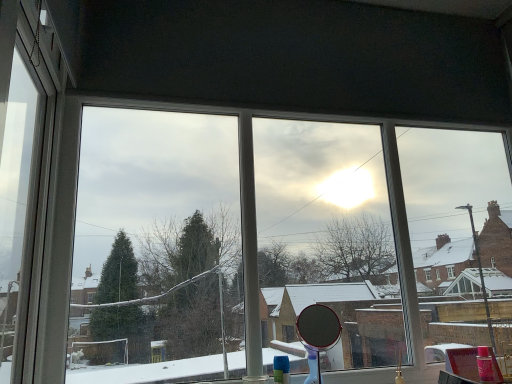
Where is `white plastic window frame at left`? Image resolution: width=512 pixels, height=384 pixels. white plastic window frame at left is located at coordinates (20, 161).

Measure the distance between point (385, 245) and camera.

The distance of point (385, 245) from camera is 11.19 feet.

The height and width of the screenshot is (384, 512). What do you see at coordinates (318, 331) in the screenshot? I see `polished silver mirror at center` at bounding box center [318, 331].

You are a GUI agent. You are given a task and a screenshot of the screen. Output one action in this format:
    pyautogui.click(x=<x>, y=<y>)
    Task: Click on the white plastic window frame at left
    The image size is (512, 384).
    Given the screenshot: What is the action you would take?
    pyautogui.click(x=20, y=161)

Which is in front, white plastic window frame at left or polished silver mirror at center?

white plastic window frame at left is in front.

From the picture: Looking at their sizes, would you say white plastic window frame at left is wider or thinner than polished silver mirror at center?

white plastic window frame at left is thinner than polished silver mirror at center.

Is polished silver mirror at center surrounded by white plastic window frame at left?

No, polished silver mirror at center is not surrounded by white plastic window frame at left.

Is white plastic window frame at left facing away from polished silver mirror at center?

No.

In terms of size, does transparent glass mirror at center appear bigger or smaller than polished silver mirror at center?

Considering their sizes, transparent glass mirror at center takes up more space than polished silver mirror at center.

Between transparent glass mirror at center and polished silver mirror at center, which one has more height?

Standing taller between the two is transparent glass mirror at center.

Can you confirm if transparent glass mirror at center is wider than polished silver mirror at center?

Yes, transparent glass mirror at center is wider than polished silver mirror at center.

How distant is transparent glass mirror at center from polished silver mirror at center?

A distance of 25.42 inches exists between transparent glass mirror at center and polished silver mirror at center.

Who is smaller, polished silver mirror at center or white plastic window frame at left?

polished silver mirror at center is smaller.

Can you confirm if polished silver mirror at center is positioned to the left of white plastic window frame at left?

No.

From the image's perspective, does polished silver mirror at center appear higher than white plastic window frame at left?

No.

In terms of width, does polished silver mirror at center look wider or thinner when compared to white plastic window frame at left?

Clearly, polished silver mirror at center has more width compared to white plastic window frame at left.

Is polished silver mirror at center turned away from transparent glass mirror at center?

Yes, polished silver mirror at center is positioned with its back facing transparent glass mirror at center.

Is polished silver mirror at center to the left or to the right of transparent glass mirror at center in the image?

polished silver mirror at center is to the left of transparent glass mirror at center.

Can you confirm if polished silver mirror at center is thinner than transparent glass mirror at center?

Indeed, polished silver mirror at center has a lesser width compared to transparent glass mirror at center.

Is transparent glass mirror at center oriented towards white plastic window frame at left?

Yes, transparent glass mirror at center is turned towards white plastic window frame at left.

Is transparent glass mirror at center bigger than white plastic window frame at left?

Yes.

From the image's perspective, is transparent glass mirror at center above white plastic window frame at left?

No, from the image's perspective, transparent glass mirror at center is not over white plastic window frame at left.

Considering the positions of objects transparent glass mirror at center and white plastic window frame at left in the image provided, who is in front, transparent glass mirror at center or white plastic window frame at left?

white plastic window frame at left is more forward.

Which of these two, white plastic window frame at left or transparent glass mirror at center, stands shorter?

Standing shorter between the two is transparent glass mirror at center.

From the image's perspective, is white plastic window frame at left over transparent glass mirror at center?

A: Yes, from the image's perspective, white plastic window frame at left is over transparent glass mirror at center.

You are a GUI agent. You are given a task and a screenshot of the screen. Output one action in this format:
    pyautogui.click(x=<x>, y=<y>)
    Task: Click on the bay window behind the white plastic window frame at left
    
    Given the screenshot: What is the action you would take?
    pyautogui.click(x=375, y=229)

Is white plastic window frame at left in contact with transparent glass mirror at center?

No, white plastic window frame at left is not with transparent glass mirror at center.

At what (x,y) coordinates should I click in order to perform the action: click on window frame above the polished silver mirror at center (from the image's perspective). Please return your answer as a coordinate pair (x, y). Looking at the image, I should click on (20, 161).

Where is `mirror located on the left of transparent glass mirror at center`? This screenshot has width=512, height=384. mirror located on the left of transparent glass mirror at center is located at coordinates (318, 331).

When comparing their distances from polished silver mirror at center, does transparent glass mirror at center or white plastic window frame at left seem further?

white plastic window frame at left is further to polished silver mirror at center.

Estimate the real-world distances between objects in this image. Which object is closer to transparent glass mirror at center, white plastic window frame at left or polished silver mirror at center?

polished silver mirror at center is closer to transparent glass mirror at center.

Based on their spatial positions, is polished silver mirror at center or transparent glass mirror at center closer to white plastic window frame at left?

Among the two, transparent glass mirror at center is located nearer to white plastic window frame at left.

Which object lies further to the anchor point white plastic window frame at left, transparent glass mirror at center or polished silver mirror at center?

polished silver mirror at center is positioned further to the anchor white plastic window frame at left.

Looking at the image, which one is located further to polished silver mirror at center, white plastic window frame at left or transparent glass mirror at center?

Among the two, white plastic window frame at left is located further to polished silver mirror at center.

Looking at the image, which one is located closer to transparent glass mirror at center, polished silver mirror at center or white plastic window frame at left?

The object closer to transparent glass mirror at center is polished silver mirror at center.

Locate an element on the screen. The height and width of the screenshot is (384, 512). mirror between white plastic window frame at left and transparent glass mirror at center from left to right is located at coordinates (318, 331).